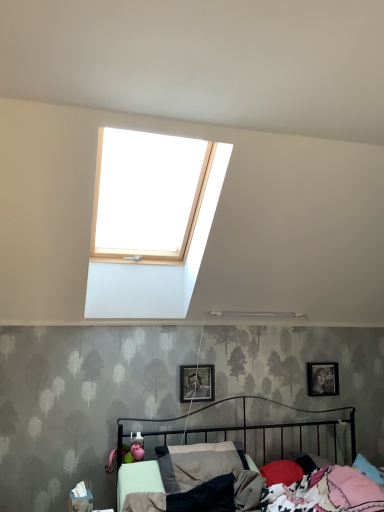
Where is `metallic silver photo frame at right, the second picture frame when ordered from front to back`? The height and width of the screenshot is (512, 384). metallic silver photo frame at right, the second picture frame when ordered from front to back is located at coordinates (323, 378).

Measure the distance between point (317, 394) and camera.

Point (317, 394) and camera are 11.00 feet apart.

Find the location of `metallic black bed at lower center`. metallic black bed at lower center is located at coordinates (198, 480).

At what (x,y) coordinates should I click in order to perform the action: click on metallic silver photo frame at right, which appears as the 1th picture frame when viewed from the back. Please return your answer as a coordinate pair (x, y). The height and width of the screenshot is (512, 384). Looking at the image, I should click on (323, 378).

Considering the sizes of objects metallic silver photo frame at right, which appears as the 1th picture frame when viewed from the back, and metallic silver photo frame at center, the 2th picture frame when ordered from right to left, in the image provided, who is bigger, metallic silver photo frame at right, which appears as the 1th picture frame when viewed from the back, or metallic silver photo frame at center, the 2th picture frame when ordered from right to left,?

metallic silver photo frame at center, the 2th picture frame when ordered from right to left.

From the image's perspective, which one is positioned lower, metallic silver photo frame at right, placed as the first picture frame when sorted from right to left, or metallic silver photo frame at center, the 1th picture frame when ordered from left to right?

From the image's view, metallic silver photo frame at right, placed as the first picture frame when sorted from right to left, is below.

Can you tell me how much metallic silver photo frame at right, the second picture frame positioned from the left, and metallic silver photo frame at center, the 1th picture frame when ordered from left to right, differ in facing direction?

The angle between the facing direction of metallic silver photo frame at right, the second picture frame positioned from the left, and the facing direction of metallic silver photo frame at center, the 1th picture frame when ordered from left to right, is 0.958 degrees.

Looking at this image, is metallic silver photo frame at right, the second picture frame positioned from the left, shorter than metallic silver photo frame at center, the 1th picture frame from the front?

In fact, metallic silver photo frame at right, the second picture frame positioned from the left, may be taller than metallic silver photo frame at center, the 1th picture frame from the front.

Is metallic black bed at lower center not near metallic silver photo frame at center, which is counted as the second picture frame, starting from the back?

Actually, metallic black bed at lower center and metallic silver photo frame at center, which is counted as the second picture frame, starting from the back, are a little close together.

Which object is positioned more to the right, metallic black bed at lower center or metallic silver photo frame at center, the 1th picture frame from the front?

Positioned to the right is metallic black bed at lower center.

Who is smaller, metallic black bed at lower center or metallic silver photo frame at center, the 2th picture frame when ordered from right to left?

metallic silver photo frame at center, the 2th picture frame when ordered from right to left.

Locate an element on the screen. The height and width of the screenshot is (512, 384). the 2nd picture frame positioned above the metallic black bed at lower center (from the image's perspective) is located at coordinates (197, 383).

Considering the sizes of objects metallic silver photo frame at center, the 2th picture frame when ordered from right to left, and metallic black bed at lower center in the image provided, who is taller, metallic silver photo frame at center, the 2th picture frame when ordered from right to left, or metallic black bed at lower center?

metallic black bed at lower center.

Which of these two, metallic silver photo frame at center, the 1th picture frame when ordered from left to right, or metallic black bed at lower center, is bigger?

metallic black bed at lower center.

Which object is closer to the camera, metallic black bed at lower center or metallic silver photo frame at right, the second picture frame positioned from the left?

metallic black bed at lower center is more forward.

Is there a large distance between metallic black bed at lower center and metallic silver photo frame at right, the second picture frame positioned from the left?

No, metallic black bed at lower center is not far away from metallic silver photo frame at right, the second picture frame positioned from the left.

From a real-world perspective, which object rests below the other?

metallic black bed at lower center is physically lower.

Is metallic black bed at lower center situated inside metallic silver photo frame at right, the second picture frame positioned from the left, or outside?

metallic black bed at lower center is not inside metallic silver photo frame at right, the second picture frame positioned from the left, it's outside.

Which of these two, metallic silver photo frame at center, the 2th picture frame when ordered from right to left, or metallic silver photo frame at right, which appears as the 1th picture frame when viewed from the back, is wider?

With larger width is metallic silver photo frame at center, the 2th picture frame when ordered from right to left.

Does metallic silver photo frame at center, the 1th picture frame when ordered from left to right, turn towards metallic silver photo frame at right, the second picture frame when ordered from front to back?

No, metallic silver photo frame at center, the 1th picture frame when ordered from left to right, does not turn towards metallic silver photo frame at right, the second picture frame when ordered from front to back.

Does point (204, 369) come closer to viewer compared to point (336, 366)?

Yes, point (204, 369) is in front of point (336, 366).

Between metallic silver photo frame at right, which appears as the 1th picture frame when viewed from the back, and metallic black bed at lower center, which one has smaller width?

With smaller width is metallic silver photo frame at right, which appears as the 1th picture frame when viewed from the back.

Is metallic silver photo frame at right, the second picture frame positioned from the left, turned away from metallic black bed at lower center?

That's not correct — metallic silver photo frame at right, the second picture frame positioned from the left, is not looking away from metallic black bed at lower center.

This screenshot has width=384, height=512. I want to click on bed below the metallic silver photo frame at right, the second picture frame when ordered from front to back (from a real-world perspective), so click(x=198, y=480).

Based on the photo, considering the relative positions of metallic silver photo frame at right, the second picture frame positioned from the left, and metallic black bed at lower center in the image provided, is metallic silver photo frame at right, the second picture frame positioned from the left, behind metallic black bed at lower center?

Yes, metallic silver photo frame at right, the second picture frame positioned from the left, is behind metallic black bed at lower center.

Locate an element on the screen. This screenshot has height=512, width=384. picture frame that appears below the metallic silver photo frame at right, placed as the first picture frame when sorted from right to left (from a real-world perspective) is located at coordinates (197, 383).

In the image, there is a metallic silver photo frame at center, the 2th picture frame when ordered from right to left. Where is `bed below it (from the image's perspective)`? This screenshot has width=384, height=512. bed below it (from the image's perspective) is located at coordinates (198, 480).

Based on their spatial positions, is metallic silver photo frame at right, placed as the first picture frame when sorted from right to left, or metallic black bed at lower center closer to metallic silver photo frame at center, the 1th picture frame from the front?

Among the two, metallic black bed at lower center is located nearer to metallic silver photo frame at center, the 1th picture frame from the front.

Which object lies nearer to the anchor point metallic silver photo frame at center, the 1th picture frame when ordered from left to right, metallic black bed at lower center or metallic silver photo frame at right, the second picture frame positioned from the left?

metallic black bed at lower center.

Looking at the image, which one is located closer to metallic black bed at lower center, metallic silver photo frame at center, the 1th picture frame when ordered from left to right, or metallic silver photo frame at right, placed as the first picture frame when sorted from right to left?

Among the two, metallic silver photo frame at center, the 1th picture frame when ordered from left to right, is located nearer to metallic black bed at lower center.

Based on their spatial positions, is metallic silver photo frame at right, placed as the first picture frame when sorted from right to left, or metallic silver photo frame at center, the 1th picture frame when ordered from left to right, further from metallic black bed at lower center?

metallic silver photo frame at right, placed as the first picture frame when sorted from right to left, is positioned further to the anchor metallic black bed at lower center.

Which object lies nearer to the anchor point metallic silver photo frame at right, placed as the first picture frame when sorted from right to left, metallic silver photo frame at center, the 1th picture frame from the front, or metallic black bed at lower center?

metallic black bed at lower center.

From the image, which object appears to be farther from metallic silver photo frame at right, which appears as the 1th picture frame when viewed from the back, metallic black bed at lower center or metallic silver photo frame at center, the 1th picture frame from the front?

metallic silver photo frame at center, the 1th picture frame from the front, is further to metallic silver photo frame at right, which appears as the 1th picture frame when viewed from the back.

Image resolution: width=384 pixels, height=512 pixels. In order to click on picture frame between metallic black bed at lower center and metallic silver photo frame at right, the second picture frame positioned from the left, from front to back in this screenshot , I will do `click(197, 383)`.